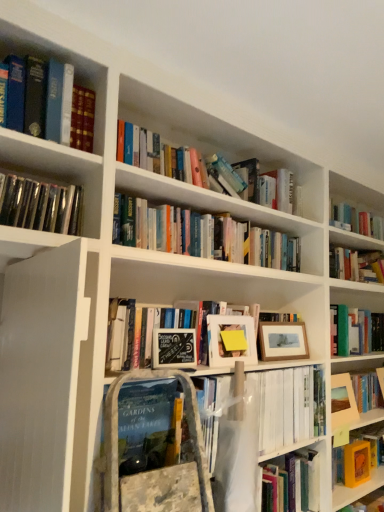
Question: Is black chalkboard sign at center, the second paperback book in the back-to-front sequence, thinner than wooden picture frame at center-right, which appears as the second picture frame when ordered from the bottom?

Choices:
 (A) no
 (B) yes

Answer: (B)

Question: Can you confirm if black chalkboard sign at center, the second paperback book in the back-to-front sequence, is wider than wooden picture frame at center-right, which is the second picture frame from back to front?

Choices:
 (A) no
 (B) yes

Answer: (A)

Question: Does black chalkboard sign at center, the first paperback book from the front, have a greater height compared to wooden picture frame at center-right, which is the second picture frame from back to front?

Choices:
 (A) yes
 (B) no

Answer: (B)

Question: Considering the relative positions of black chalkboard sign at center, which ranks as the first paperback book in top-to-bottom order, and wooden picture frame at center-right, the second picture frame when ordered from front to back, in the image provided, is black chalkboard sign at center, which ranks as the first paperback book in top-to-bottom order, to the left of wooden picture frame at center-right, the second picture frame when ordered from front to back, from the viewer's perspective?

Choices:
 (A) yes
 (B) no

Answer: (A)

Question: Is black chalkboard sign at center, the second paperback book in the back-to-front sequence, beside wooden picture frame at center-right, the second picture frame viewed from the top?

Choices:
 (A) no
 (B) yes

Answer: (A)

Question: Is hardcover book at center, positioned as the third book in top-to-bottom order, to the left or to the right of matte wooden picture frame at right, which appears as the 1th picture frame when ordered from the bottom, in the image?

Choices:
 (A) left
 (B) right

Answer: (A)

Question: Is hardcover book at center, positioned as the third book in top-to-bottom order, taller or shorter than matte wooden picture frame at right, marked as the 1th picture frame in a back-to-front arrangement?

Choices:
 (A) short
 (B) tall

Answer: (A)

Question: From the image's perspective, relative to matte wooden picture frame at right, which is the third picture frame from top to bottom, is hardcover book at center, positioned as the third book in top-to-bottom order, above or below?

Choices:
 (A) below
 (B) above

Answer: (B)

Question: Is hardcover book at center, positioned as the third book in top-to-bottom order, in front of or behind matte wooden picture frame at right, which is the third picture frame from top to bottom, in the image?

Choices:
 (A) behind
 (B) front

Answer: (B)

Question: Considering the positions of hardcover book at center, which is the 1th book from bottom to top, and shiny black vinyl records at upper left, which is the 2th book from bottom to top, in the image, is hardcover book at center, which is the 1th book from bottom to top, taller or shorter than shiny black vinyl records at upper left, which is the 2th book from bottom to top,?

Choices:
 (A) tall
 (B) short

Answer: (A)

Question: Considering the relative positions of hardcover book at center, positioned as the third book in top-to-bottom order, and shiny black vinyl records at upper left, which is the second book from top to bottom, in the image provided, is hardcover book at center, positioned as the third book in top-to-bottom order, to the left or to the right of shiny black vinyl records at upper left, which is the second book from top to bottom,?

Choices:
 (A) left
 (B) right

Answer: (B)

Question: Would you say hardcover book at center, positioned as the third book in top-to-bottom order, is inside or outside shiny black vinyl records at upper left, which is the 2th book from bottom to top?

Choices:
 (A) outside
 (B) inside

Answer: (A)

Question: In terms of size, does hardcover book at center, which is the 1th book from bottom to top, appear bigger or smaller than shiny black vinyl records at upper left, which is the 2th book from bottom to top?

Choices:
 (A) small
 (B) big

Answer: (A)

Question: From a real-world perspective, is hardcover book at center, which is the 1th book from bottom to top, physically located above or below black chalkboard sign at center, the first paperback book viewed from the left?

Choices:
 (A) above
 (B) below

Answer: (B)

Question: Is hardcover book at center, positioned as the third book in top-to-bottom order, inside the boundaries of black chalkboard sign at center, the first paperback book viewed from the left, or outside?

Choices:
 (A) outside
 (B) inside

Answer: (A)